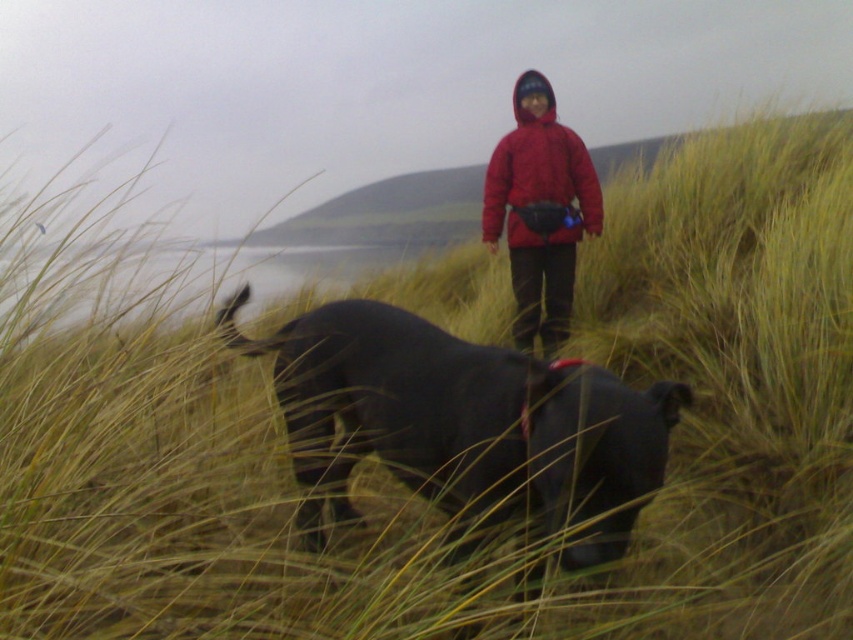
You are a photographer trying to capture a photo of the black matte dog at center and the matte red jacket at center. The camera can focus on objects within a 2.5 meter range. Will both subjects be in focus?

The black matte dog at center and the matte red jacket at center are 3.02 meters apart. Since the camera can only focus within a 2.5 meter range, the distance between them exceeds the focus range. Therefore, both subjects cannot be in focus simultaneously.

What is the location of the point with coordinates (465,420) in the scene?

The point with coordinates (465,420) is located on the black matte dog at center.

You are a photographer trying to capture a photo of the matte red jacket at center and the black matte dog at center. From the photographer perspective, which object is located to the right side?

The matte red jacket at center is located to the right side of the black matte dog at center.